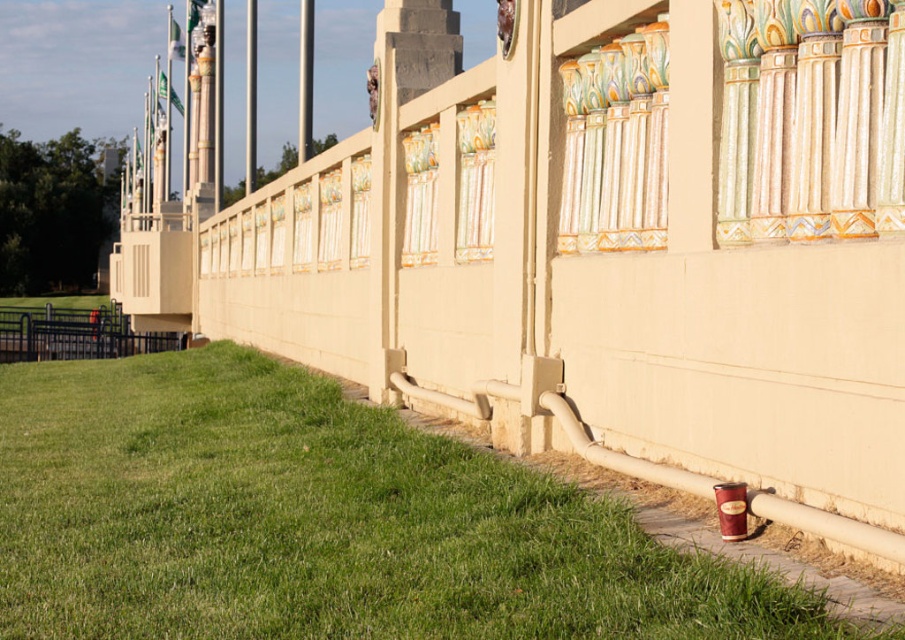
Can you confirm if green grass at lower left is bigger than black metal fence at lower left?

Actually, green grass at lower left might be smaller than black metal fence at lower left.

What do you see at coordinates (319, 522) in the screenshot? Image resolution: width=905 pixels, height=640 pixels. I see `green grass at lower left` at bounding box center [319, 522].

This screenshot has height=640, width=905. I want to click on green grass at lower left, so click(x=319, y=522).